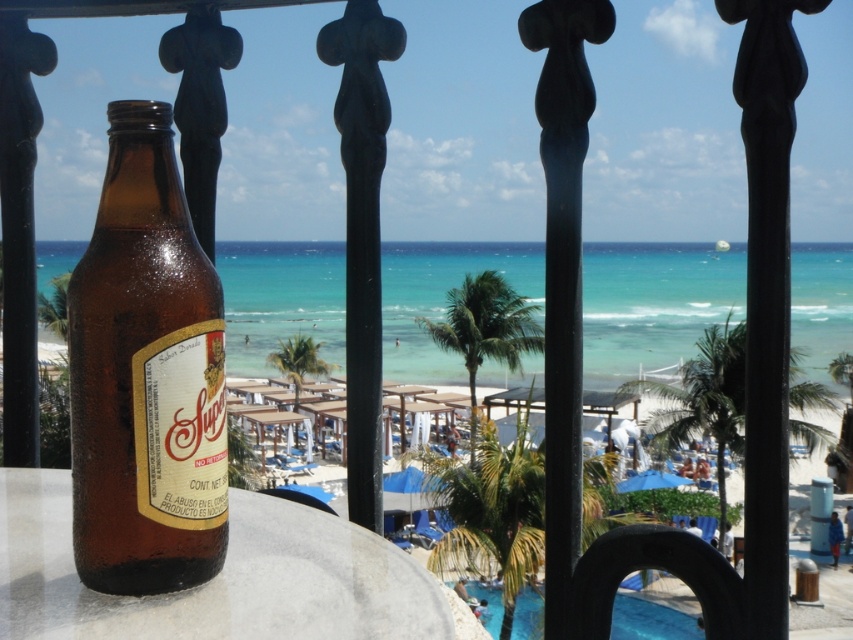
Can you confirm if brown glass bottle at left is positioned to the left of smooth white table at center?

In fact, brown glass bottle at left is to the right of smooth white table at center.

Is brown glass bottle at left below smooth white table at center?

No, brown glass bottle at left is not below smooth white table at center.

Which is in front, point (152, 451) or point (59, 552)?

Point (152, 451) is more forward.

What are the coordinates of `brown glass bottle at left` in the screenshot? It's located at (144, 376).

Can you confirm if brown glass bottle at left is positioned below blue glossy pool at lower center?

Actually, brown glass bottle at left is above blue glossy pool at lower center.

Locate an element on the screen. The height and width of the screenshot is (640, 853). brown glass bottle at left is located at coordinates (144, 376).

Does smooth white table at center appear under blue glossy pool at lower center?

No, smooth white table at center is not below blue glossy pool at lower center.

Who is positioned more to the right, smooth white table at center or blue glossy pool at lower center?

Positioned to the right is blue glossy pool at lower center.

Is point (328, 589) positioned behind point (647, 600)?

That is False.

This screenshot has height=640, width=853. In order to click on smooth white table at center in this screenshot , I will do `click(215, 577)`.